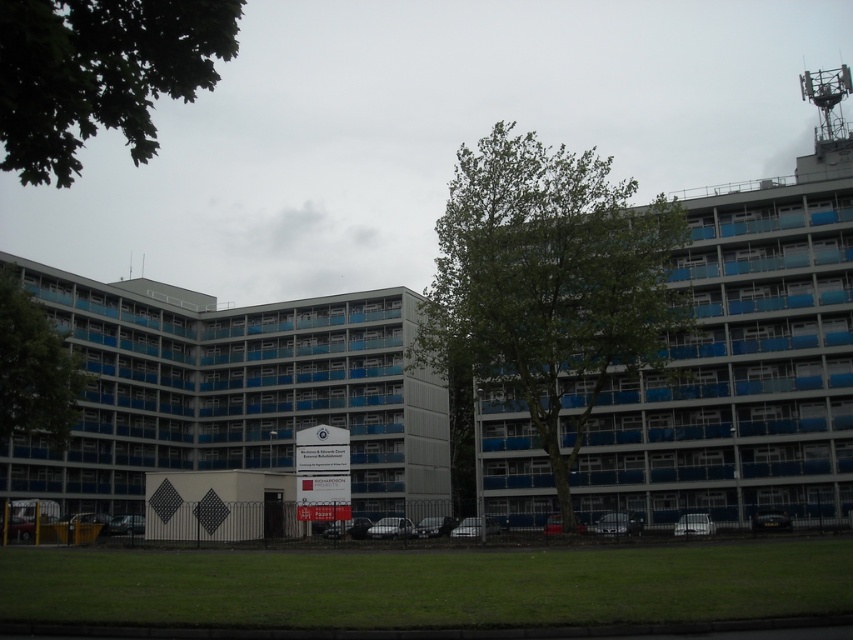
Does green leafy tree at center have a lesser height compared to green leafy tree at left?

Incorrect, green leafy tree at center's height does not fall short of green leafy tree at left's.

Where is `green leafy tree at center`? green leafy tree at center is located at coordinates (547, 285).

Locate an element on the screen. The height and width of the screenshot is (640, 853). green leafy tree at center is located at coordinates (547, 285).

Does point (514, 328) come in front of point (158, 52)?

No, (514, 328) is behind (158, 52).

Identify the location of green leafy tree at center. Image resolution: width=853 pixels, height=640 pixels. (547, 285).

Between green leafy tree at upper left and green leafy tree at left, which one is positioned lower?

green leafy tree at left is lower down.

Can you confirm if green leafy tree at upper left is positioned above green leafy tree at left?

Indeed, green leafy tree at upper left is positioned over green leafy tree at left.

Find the location of a particular element. This screenshot has height=640, width=853. green leafy tree at upper left is located at coordinates (100, 74).